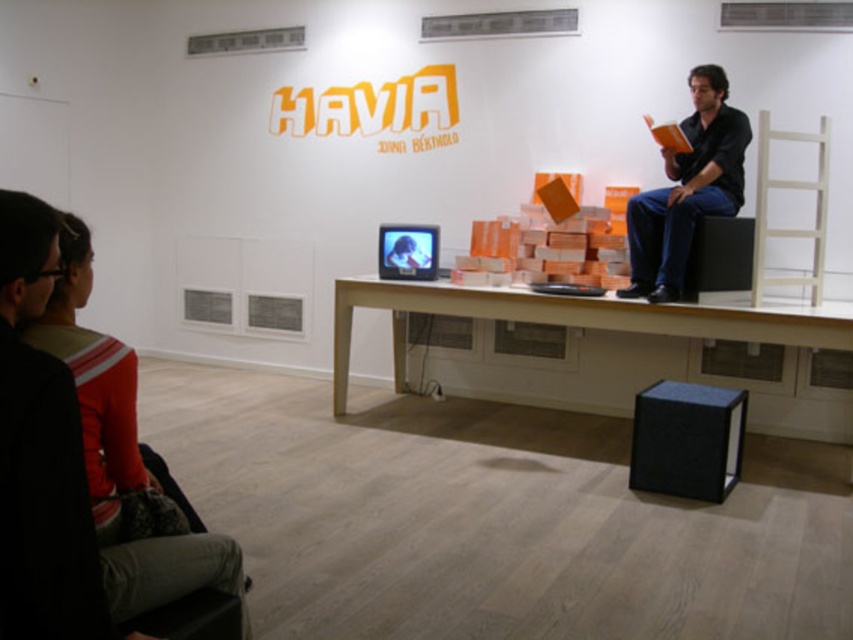
Question: Estimate the real-world distances between objects in this image. Which object is farther from the black fabric speaker at lower center?

Choices:
 (A) white wood table at center
 (B) matte black shirt at upper right
 (C) orange sweater at upper left

Answer: (C)

Question: Estimate the real-world distances between objects in this image. Which object is closer to the black fabric speaker at lower center?

Choices:
 (A) orange sweater at upper left
 (B) white wood table at center

Answer: (B)

Question: Can you confirm if black fabric speaker at lower center is smaller than black matte speaker at center?

Choices:
 (A) yes
 (B) no

Answer: (B)

Question: Can you confirm if white wood table at center is positioned above black fabric speaker at lower center?

Choices:
 (A) yes
 (B) no

Answer: (A)

Question: Considering the real-world distances, which object is closest to the black fabric speaker at lower center?

Choices:
 (A) black matte speaker at center
 (B) white wood table at center
 (C) orange sweater at upper left

Answer: (B)

Question: Does white wood table at center appear over black fabric speaker at lower center?

Choices:
 (A) no
 (B) yes

Answer: (B)